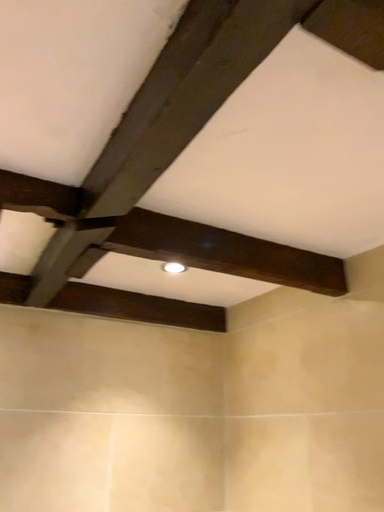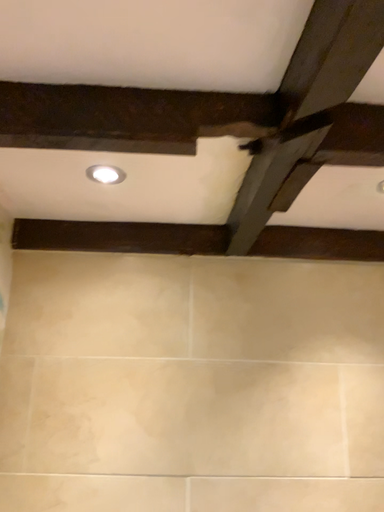
Question: How did the camera likely rotate when shooting the video?

Choices:
 (A) rotated downward
 (B) rotated upward

Answer: (A)